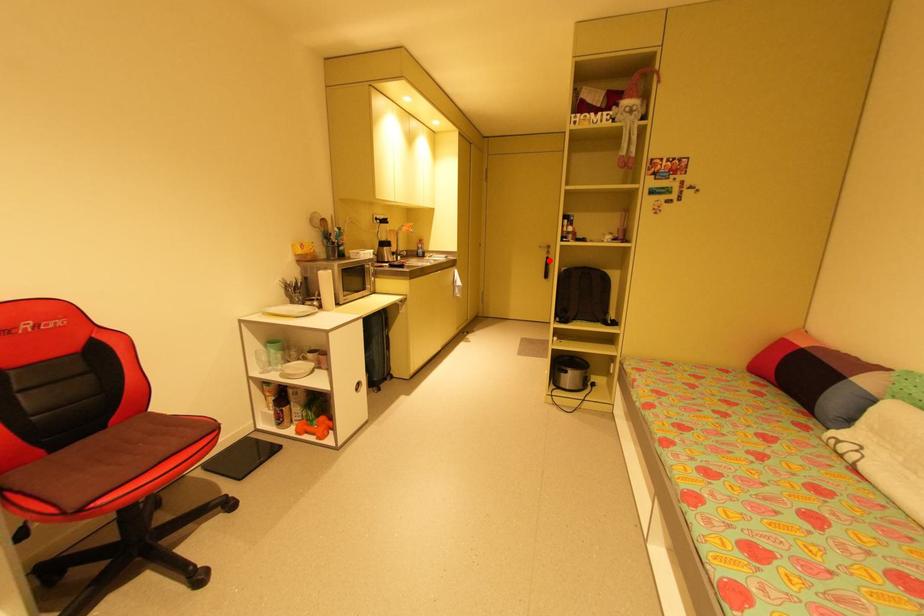
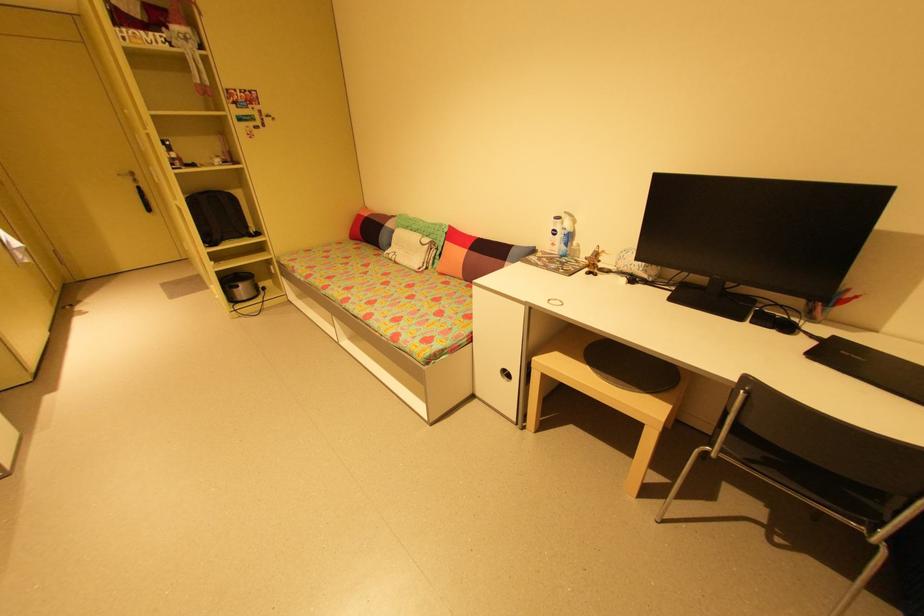
Question: I am providing you with two images of the same scene from different viewpoints. Image1 has a red point marked. In image2, the corresponding 3D location appears at what relative position? Reply with the corresponding letter.

Choices:
 (A) Closer
 (B) Farther

Answer: (B)